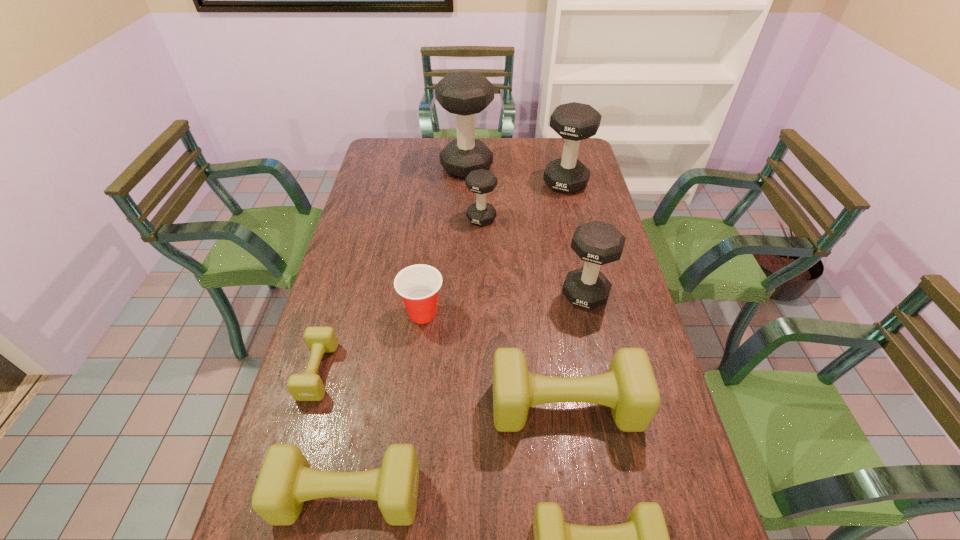
At what (x,y) coordinates should I click in order to perform the action: click on object that stands as the seventh closest to the seventh shortest object. Please return your answer as a coordinate pair (x, y). This screenshot has height=540, width=960. Looking at the image, I should click on (286, 480).

The width and height of the screenshot is (960, 540). In order to click on object that is the sixth nearest to the tallest dumbbell in this screenshot , I will do `click(629, 388)`.

At what (x,y) coordinates should I click in order to perform the action: click on dumbbell that stands as the third closest to the fifth tallest dumbbell. Please return your answer as a coordinate pair (x, y). Looking at the image, I should click on (597, 243).

Identify which dumbbell is located as the fourth nearest to the red cup. Please provide its 2D coordinates. Your answer should be formatted as a tuple, i.e. [(x, y)], where the tuple contains the x and y coordinates of a point satisfying the conditions above.

[(597, 243)]

Image resolution: width=960 pixels, height=540 pixels. What are the coordinates of `gray dumbbell object that ranks as the second closest to the biggest gray dumbbell` in the screenshot? It's located at (573, 121).

Find the location of `gray dumbbell that is the third closest to the third farthest dumbbell`. gray dumbbell that is the third closest to the third farthest dumbbell is located at coordinates (597, 243).

Where is `olive dumbbell that is the second closest to the fifth tallest dumbbell`? olive dumbbell that is the second closest to the fifth tallest dumbbell is located at coordinates (x=286, y=480).

Locate which olive dumbbell ranks in proximity to the third biggest olive dumbbell. Please provide its 2D coordinates. Your answer should be formatted as a tuple, i.e. [(x, y)], where the tuple contains the x and y coordinates of a point satisfying the conditions above.

[(629, 388)]